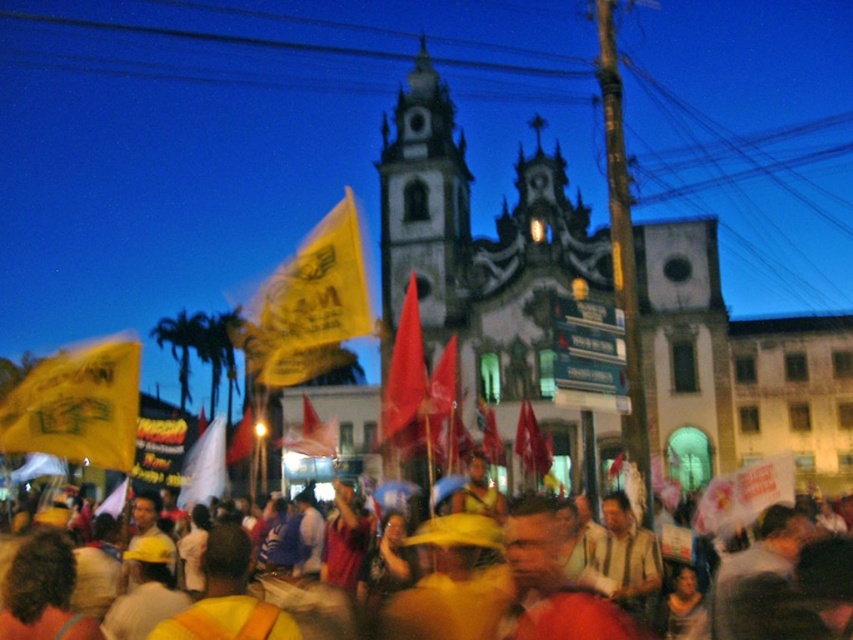
You are standing in the crowd at the nighttime event in front of the historic building. There is a specific point marked at coordinates point (131, 412). Can you estimate how far this point is from your current position?

The point (131, 412) is 114.91 meters away from the viewer, so the distance is approximately 114.91 meters.

You are a photographer at the event and want to capture both the red fabric flag at center and the yellow fabric flag at center in a single frame. Which flag should you focus on to ensure both are visible without cropping?

The red fabric flag at center occupies less space than the yellow fabric flag at center, so focusing on the larger yellow fabric flag at center would allow the smaller red fabric flag at center to fit into the frame without cropping.